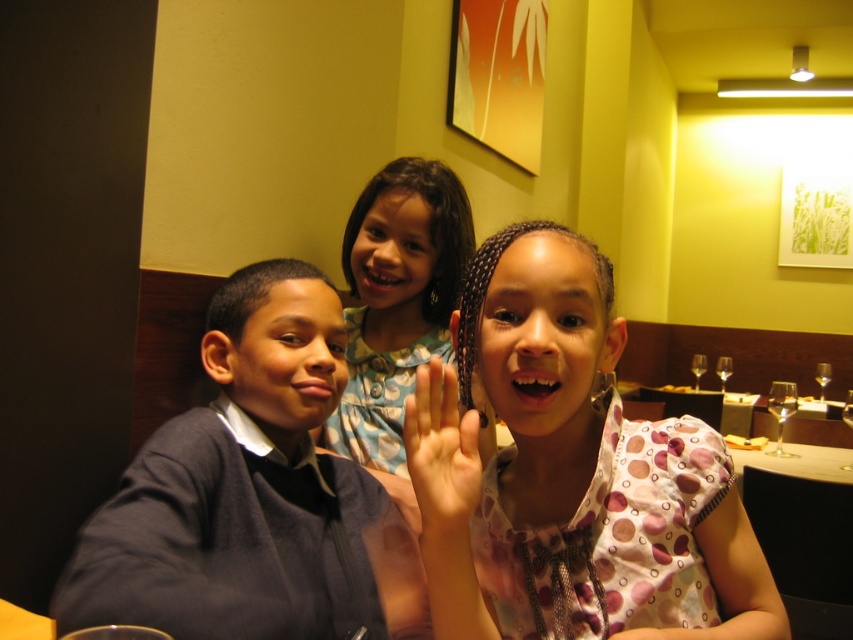
Between point (372, 221) and point (433, 449), which one is positioned behind?

Positioned behind is point (372, 221).

At what (x,y) coordinates should I click in order to perform the action: click on blue dotted dress at center. Please return your answer as a coordinate pair (x, y). The height and width of the screenshot is (640, 853). Looking at the image, I should click on (396, 300).

Does pink dotted dress at center have a greater height compared to light skin tone palm at center?

Indeed, pink dotted dress at center has a greater height compared to light skin tone palm at center.

Is point (561, 522) positioned behind point (444, 388)?

Yes, it is behind point (444, 388).

What are the coordinates of `pink dotted dress at center` in the screenshot? It's located at (572, 472).

Between pink dotted dress at center and dark blue sweater at left, which one has less height?

pink dotted dress at center

Between point (637, 493) and point (323, 576), which one is positioned in front?

Point (637, 493) is in front.

Is point (515, 291) more distant than point (355, 563)?

No.

Locate an element on the screen. pink dotted dress at center is located at coordinates (572, 472).